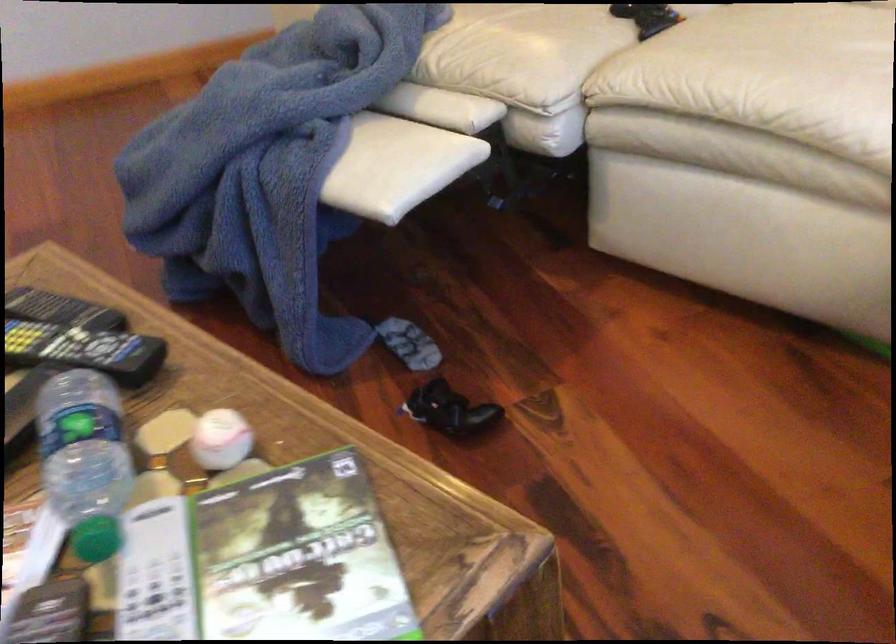
Where would you lift the black shoe? Please return your answer as a coordinate pair (x, y).

(449, 410)